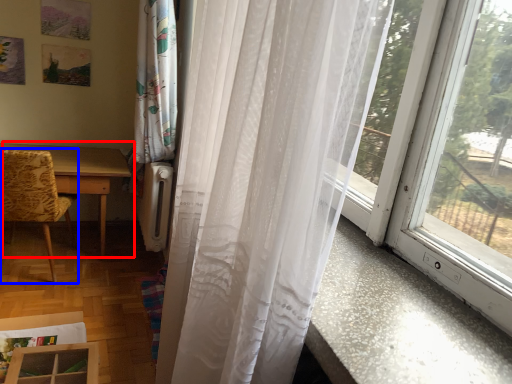
Question: Which point is closer to the camera, table (highlighted by a red box) or chair (highlighted by a blue box)?

Choices:
 (A) table
 (B) chair

Answer: (B)